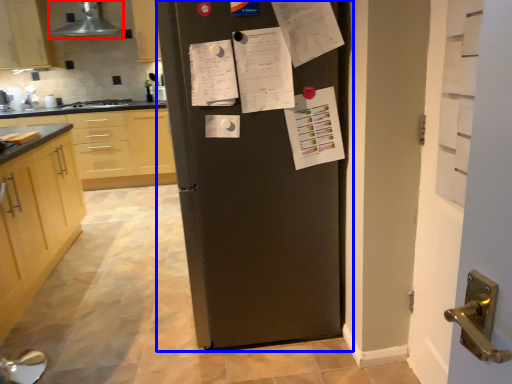
Question: Which object is further to the camera taking this photo, exhaust hood (highlighted by a red box) or refrigerator (highlighted by a blue box)?

Choices:
 (A) exhaust hood
 (B) refrigerator

Answer: (A)